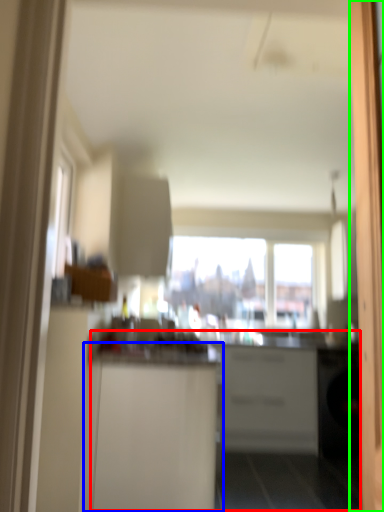
Question: Which is nearer to the counter (highlighted by a red box)? cabinetry (highlighted by a blue box) or screen door (highlighted by a green box).

Choices:
 (A) cabinetry
 (B) screen door

Answer: (A)